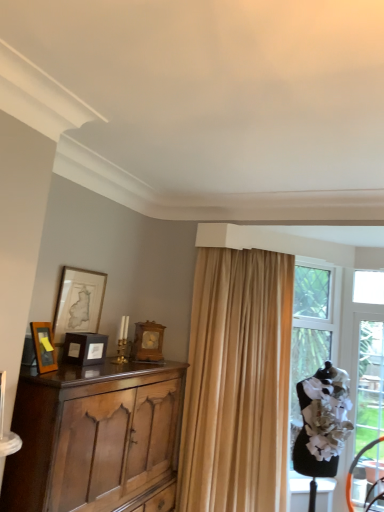
This screenshot has width=384, height=512. What do you see at coordinates (148, 342) in the screenshot? I see `wooden clock at center, the 4th picture frame in the front-to-back sequence` at bounding box center [148, 342].

I want to click on beige fabric curtain at center, so pos(237,383).

You are a GUI agent. You are given a task and a screenshot of the screen. Output one action in this format:
    pyautogui.click(x=<x>, y=<y>)
    Task: Click on the matte black picture frame at center, which is the third picture frame from back to front
    
    Given the screenshot: What is the action you would take?
    pyautogui.click(x=85, y=348)

Between wooden clock at center, the 4th picture frame in the front-to-back sequence, and matte wooden picture frame at left, marked as the first picture frame in a front-to-back arrangement, which one has larger size?

With larger size is wooden clock at center, the 4th picture frame in the front-to-back sequence.

Is wooden clock at center, arranged as the first picture frame when viewed from the back, turned away from matte wooden picture frame at left, marked as the first picture frame in a front-to-back arrangement?

No.

From a real-world perspective, is wooden clock at center, arranged as the first picture frame when viewed from the back, positioned over matte wooden picture frame at left, which is the fourth picture frame in back-to-front order, based on gravity?

Yes, from a real-world perspective, wooden clock at center, arranged as the first picture frame when viewed from the back, is above matte wooden picture frame at left, which is the fourth picture frame in back-to-front order.

Can you tell me how much wooden clock at center, arranged as the first picture frame when viewed from the back, and matte wooden picture frame at left, marked as the first picture frame in a front-to-back arrangement, differ in facing direction?

The angle between the facing direction of wooden clock at center, arranged as the first picture frame when viewed from the back, and the facing direction of matte wooden picture frame at left, marked as the first picture frame in a front-to-back arrangement, is 64 degrees.

There is a beige fabric curtain at center. Where is `the 1st picture frame above it (from a real-world perspective)`? This screenshot has width=384, height=512. the 1st picture frame above it (from a real-world perspective) is located at coordinates (85, 348).

In the scene shown: What's the angular difference between matte black picture frame at center, which ranks as the 2th picture frame in front-to-back order, and beige fabric curtain at center's facing directions?

matte black picture frame at center, which ranks as the 2th picture frame in front-to-back order, and beige fabric curtain at center are facing 48 degrees away from each other.

From a real-world perspective, is matte black picture frame at center, which is the third picture frame from back to front, physically above beige fabric curtain at center?

Yes, from a real-world perspective, matte black picture frame at center, which is the third picture frame from back to front, is above beige fabric curtain at center.

Looking at this image, are matte black picture frame at center, which is the third picture frame from back to front, and beige fabric curtain at center beside each other?

They are not placed beside each other.

Looking at the image, does matte wooden picture frame at left, marked as the first picture frame in a front-to-back arrangement, seem bigger or smaller compared to matte black picture frame at center, which is the third picture frame from back to front?

In the image, matte wooden picture frame at left, marked as the first picture frame in a front-to-back arrangement, appears to be smaller than matte black picture frame at center, which is the third picture frame from back to front.

Consider the image. Which is more to the right, matte wooden picture frame at left, which is the fourth picture frame in back-to-front order, or matte black picture frame at center, which is the third picture frame from back to front?

From the viewer's perspective, matte black picture frame at center, which is the third picture frame from back to front, appears more on the right side.

Which object is more forward, matte wooden picture frame at left, which is the fourth picture frame in back-to-front order, or matte black picture frame at center, which ranks as the 2th picture frame in front-to-back order?

matte wooden picture frame at left, which is the fourth picture frame in back-to-front order, is more forward.

Is matte wooden picture frame at left, marked as the first picture frame in a front-to-back arrangement, outside of matte black picture frame at center, which is the third picture frame from back to front?

That's correct, matte wooden picture frame at left, marked as the first picture frame in a front-to-back arrangement, is outside of matte black picture frame at center, which is the third picture frame from back to front.

From a real-world perspective, which object rests below the other?

In real-world perspective, polished wood cabinet at left is lower.

In the scene shown: Does matte wooden picture frame at left, marked as the first picture frame in a front-to-back arrangement, lie behind polished wood cabinet at left?

Yes, it is behind polished wood cabinet at left.

Which of these two, matte wooden picture frame at left, marked as the first picture frame in a front-to-back arrangement, or polished wood cabinet at left, stands taller?

polished wood cabinet at left.

Considering the points (35, 325) and (102, 477), which point is behind, point (35, 325) or point (102, 477)?

Positioned behind is point (102, 477).

Where is `picture frame above the matte wooden picture frame at left, marked as the first picture frame in a front-to-back arrangement (from the image's perspective)`? The image size is (384, 512). picture frame above the matte wooden picture frame at left, marked as the first picture frame in a front-to-back arrangement (from the image's perspective) is located at coordinates (78, 302).

Considering the relative sizes of matte wooden picture frame at left, which is the fourth picture frame in back-to-front order, and matte gold picture frame at upper left, the third picture frame viewed from the front, in the image provided, is matte wooden picture frame at left, which is the fourth picture frame in back-to-front order, taller than matte gold picture frame at upper left, the third picture frame viewed from the front,?

Incorrect, the height of matte wooden picture frame at left, which is the fourth picture frame in back-to-front order, is not larger of that of matte gold picture frame at upper left, the third picture frame viewed from the front.

How many degrees apart are the facing directions of matte wooden picture frame at left, which is the fourth picture frame in back-to-front order, and matte gold picture frame at upper left, the third picture frame viewed from the front?

The angle between the facing direction of matte wooden picture frame at left, which is the fourth picture frame in back-to-front order, and the facing direction of matte gold picture frame at upper left, the third picture frame viewed from the front, is 20 degrees.

From a real-world perspective, is matte wooden picture frame at left, which is the fourth picture frame in back-to-front order, positioned over matte gold picture frame at upper left, the third picture frame viewed from the front, based on gravity?

No, from a real-world perspective, matte wooden picture frame at left, which is the fourth picture frame in back-to-front order, is not on top of matte gold picture frame at upper left, the third picture frame viewed from the front.

Is wooden clock at center, the 4th picture frame in the front-to-back sequence, inside clear glass door at right?

Actually, wooden clock at center, the 4th picture frame in the front-to-back sequence, is outside clear glass door at right.

Which object is positioned more to the left, clear glass door at right or wooden clock at center, the 4th picture frame in the front-to-back sequence?

From the viewer's perspective, wooden clock at center, the 4th picture frame in the front-to-back sequence, appears more on the left side.

From a real-world perspective, count 3rd picture frames upward from the clear glass door at right and point to it. Please provide its 2D coordinates.

[(148, 342)]

From a real-world perspective, which object rests below the other?

From a 3D spatial view, beige fabric curtain at center is below.

Is wooden clock at center, the 4th picture frame in the front-to-back sequence, bigger than beige fabric curtain at center?

Actually, wooden clock at center, the 4th picture frame in the front-to-back sequence, might be smaller than beige fabric curtain at center.

Which object is closer to the camera, wooden clock at center, arranged as the first picture frame when viewed from the back, or beige fabric curtain at center?

Positioned in front is beige fabric curtain at center.

Where is `the 1st picture frame to the left of the beige fabric curtain at center, starting your count from the anchor`? This screenshot has width=384, height=512. the 1st picture frame to the left of the beige fabric curtain at center, starting your count from the anchor is located at coordinates (148, 342).

Identify the location of picture frame that is the 2nd one when counting upward from the wooden clock at center, arranged as the first picture frame when viewed from the back (from the image's perspective). The image size is (384, 512). (44, 346).

Identify the location of curtain that is on the right side of matte black picture frame at center, which ranks as the 2th picture frame in front-to-back order. The height and width of the screenshot is (512, 384). (237, 383).

Which object lies nearer to the anchor point clear glass door at right, wooden clock at center, arranged as the first picture frame when viewed from the back, or matte black picture frame at center, which ranks as the 2th picture frame in front-to-back order?

Based on the image, wooden clock at center, arranged as the first picture frame when viewed from the back, appears to be nearer to clear glass door at right.

Estimate the real-world distances between objects in this image. Which object is further from matte gold picture frame at upper left, the third picture frame viewed from the front, matte wooden picture frame at left, which is the fourth picture frame in back-to-front order, or matte black picture frame at center, which is the third picture frame from back to front?

matte wooden picture frame at left, which is the fourth picture frame in back-to-front order, lies further to matte gold picture frame at upper left, the third picture frame viewed from the front, than the other object.

Estimate the real-world distances between objects in this image. Which object is further from matte black picture frame at center, which ranks as the 2th picture frame in front-to-back order, polished wood cabinet at left or clear glass door at right?

clear glass door at right is further to matte black picture frame at center, which ranks as the 2th picture frame in front-to-back order.

From the image, which object appears to be farther from matte gold picture frame at upper left, the third picture frame viewed from the front, beige fabric curtain at center or polished wood cabinet at left?

The object further to matte gold picture frame at upper left, the third picture frame viewed from the front, is beige fabric curtain at center.

Consider the image. Looking at the image, which one is located further to matte black picture frame at center, which ranks as the 2th picture frame in front-to-back order, matte gold picture frame at upper left, the third picture frame viewed from the front, or matte wooden picture frame at left, marked as the first picture frame in a front-to-back arrangement?

The object further to matte black picture frame at center, which ranks as the 2th picture frame in front-to-back order, is matte wooden picture frame at left, marked as the first picture frame in a front-to-back arrangement.

Estimate the real-world distances between objects in this image. Which object is closer to matte gold picture frame at upper left, the third picture frame viewed from the front, matte black picture frame at center, which is the third picture frame from back to front, or beige fabric curtain at center?

The object closer to matte gold picture frame at upper left, the third picture frame viewed from the front, is matte black picture frame at center, which is the third picture frame from back to front.

In the scene shown: Based on their spatial positions, is clear glass door at right or matte black picture frame at center, which ranks as the 2th picture frame in front-to-back order, further from wooden clock at center, the 4th picture frame in the front-to-back sequence?

clear glass door at right lies further to wooden clock at center, the 4th picture frame in the front-to-back sequence, than the other object.

When comparing their distances from polished wood cabinet at left, does matte wooden picture frame at left, marked as the first picture frame in a front-to-back arrangement, or matte black picture frame at center, which ranks as the 2th picture frame in front-to-back order, seem further?

The object further to polished wood cabinet at left is matte wooden picture frame at left, marked as the first picture frame in a front-to-back arrangement.

You are a GUI agent. You are given a task and a screenshot of the screen. Output one action in this format:
    pyautogui.click(x=<x>, y=<y>)
    Task: Click on the cabinetry between matte black picture frame at center, which ranks as the 2th picture frame in front-to-back order, and clear glass door at right, in the horizontal direction
    The height and width of the screenshot is (512, 384).
    Given the screenshot: What is the action you would take?
    pyautogui.click(x=92, y=435)

Where is `curtain situated between polished wood cabinet at left and clear glass door at right from left to right`? This screenshot has width=384, height=512. curtain situated between polished wood cabinet at left and clear glass door at right from left to right is located at coordinates (237, 383).

Find the location of a particular element. This screenshot has height=512, width=384. cabinetry situated between matte black picture frame at center, which is the third picture frame from back to front, and beige fabric curtain at center from left to right is located at coordinates (92, 435).

Find the location of a particular element. cabinetry between matte gold picture frame at upper left, the second picture frame viewed from the back, and beige fabric curtain at center from left to right is located at coordinates tap(92, 435).